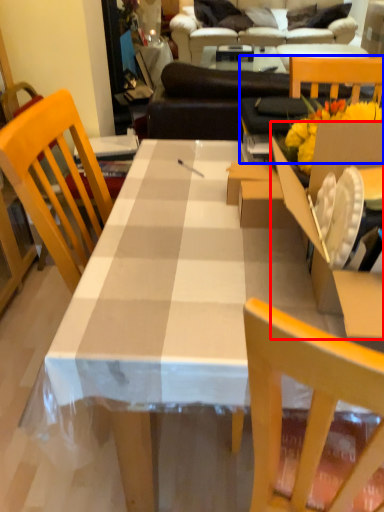
Question: Which object appears farthest to the camera in this image, cardboard box (highlighted by a red box) or chair (highlighted by a blue box)?

Choices:
 (A) cardboard box
 (B) chair

Answer: (B)